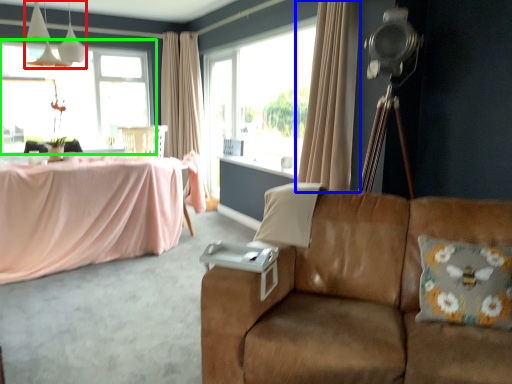
Question: Which object is positioned farthest from fixture (highlighted by a red box)? Select from curtain (highlighted by a blue box) and window (highlighted by a green box).

Choices:
 (A) curtain
 (B) window

Answer: (A)